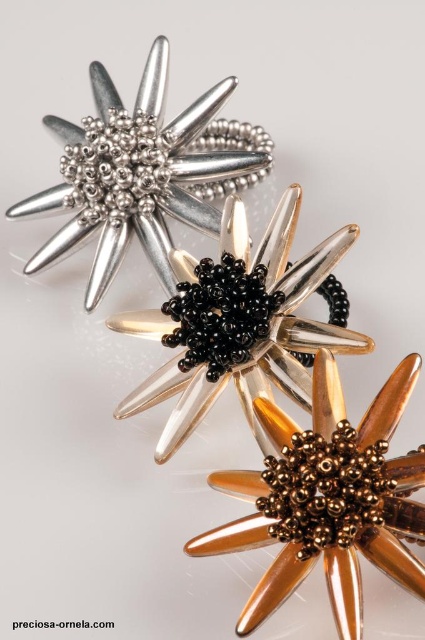
You are an interior designer arranging these flowers in a narrow vase. The gold metallic flower at center has a width of 10 cm. Can the black beaded flower at center fit in the same vase if the vase can only accommodate up to 12 cm in width?

The black beaded flower at center might be wider than the gold metallic flower at center, which is 10 cm. Since the vase can only hold up to 12 cm, there is a possibility it may not fit if the black beaded flower exceeds 12 cm in width.

You are an interior designer arranging two decorative flowers on a shelf. You have a black beaded flower at center and a gold metallic flower at center. According to the image, which flower should you place on the left side of the shelf to match the original arrangement?

The black beaded flower at center should be placed on the left side of the shelf because in the image, the black beaded flower at center is to the left of the gold metallic flower at center.

You are an interior designer arranging these decorative pieces on a shelf. You need to ensure that the smaller gold metallic flower at center is placed in a position where it won not be overshadowed by the larger matte silver flower at upper left. Where should you place it?

The gold metallic flower at center is smaller than the matte silver flower at upper left. To prevent it from being overshadowed, place the gold metallic flower at center to the side or in front of the matte silver flower at upper left so it remains visible.